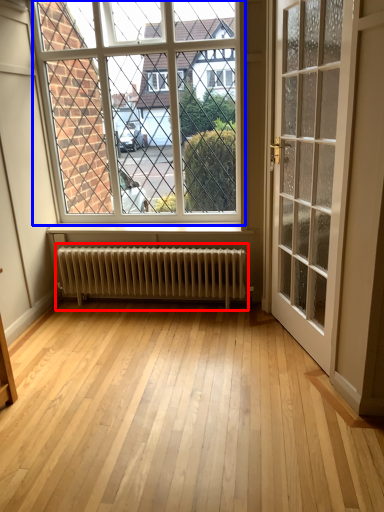
Question: Among these objects, which one is nearest to the camera, radiator (highlighted by a red box) or window (highlighted by a blue box)?

Choices:
 (A) radiator
 (B) window

Answer: (B)